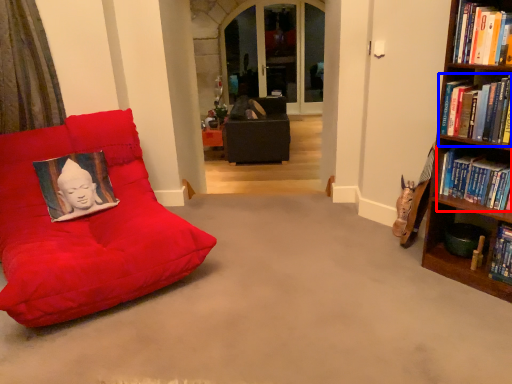
Question: Which of the following is the farthest to the observer, book (highlighted by a red box) or book (highlighted by a blue box)?

Choices:
 (A) book
 (B) book

Answer: (A)